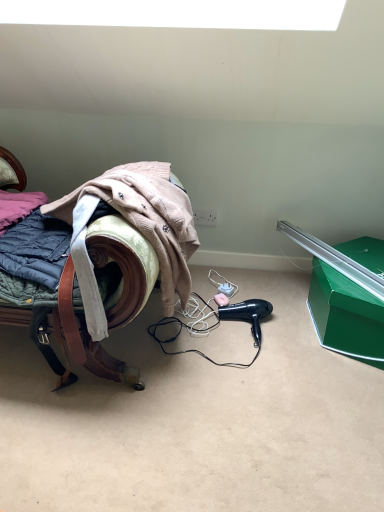
This screenshot has height=512, width=384. What are the coordinates of `velvet green suitcase at left` in the screenshot? It's located at (105, 263).

You are a GUI agent. You are given a task and a screenshot of the screen. Output one action in this format:
    pyautogui.click(x=<x>, y=<y>)
    Task: Click on the black plastic hair dryer at lower center
    
    Given the screenshot: What is the action you would take?
    pyautogui.click(x=247, y=314)

Is velvet green suitcase at left taller or shorter than green cardboard box at lower right?

Considering their sizes, velvet green suitcase at left has more height than green cardboard box at lower right.

From a real-world perspective, between velvet green suitcase at left and green cardboard box at lower right, who is vertically lower?

green cardboard box at lower right is physically lower.

From the image's perspective, is velvet green suitcase at left on top of green cardboard box at lower right?

Correct, velvet green suitcase at left appears higher than green cardboard box at lower right in the image.

From a real-world perspective, is velvet green suitcase at left on top of black plastic hair dryer at lower center?

Yes, from a real-world perspective, velvet green suitcase at left is above black plastic hair dryer at lower center.

Is velvet green suitcase at left looking in the opposite direction of black plastic hair dryer at lower center?

No.

Is velvet green suitcase at left positioned beyond the bounds of black plastic hair dryer at lower center?

That's correct, velvet green suitcase at left is outside of black plastic hair dryer at lower center.

Considering the relative positions of velvet green suitcase at left and black plastic hair dryer at lower center in the image provided, is velvet green suitcase at left to the right of black plastic hair dryer at lower center from the viewer's perspective?

Incorrect, velvet green suitcase at left is not on the right side of black plastic hair dryer at lower center.

You are a GUI agent. You are given a task and a screenshot of the screen. Output one action in this format:
    pyautogui.click(x=<x>, y=<y>)
    Task: Click on the box below the velvet green suitcase at left (from the image's perspective)
    The image size is (384, 512).
    Given the screenshot: What is the action you would take?
    pyautogui.click(x=346, y=315)

Does point (358, 317) lie in front of point (134, 293)?

No.

Which is more to the right, green cardboard box at lower right or velvet green suitcase at left?

green cardboard box at lower right is more to the right.

Is black plastic hair dryer at lower center not within green cardboard box at lower right?

black plastic hair dryer at lower center lies outside green cardboard box at lower right's area.

Which object is further away from the camera taking this photo, black plastic hair dryer at lower center or green cardboard box at lower right?

black plastic hair dryer at lower center is more distant.

Does black plastic hair dryer at lower center have a lesser height compared to green cardboard box at lower right?

Yes.

Based on the photo, from the image's perspective, between black plastic hair dryer at lower center and green cardboard box at lower right, which one is located above?

green cardboard box at lower right is shown above in the image.

Measure the distance from black plastic hair dryer at lower center to velvet green suitcase at left.

black plastic hair dryer at lower center is 60.37 centimeters away from velvet green suitcase at left.

Is point (239, 317) positioned before point (88, 366)?

No, (239, 317) is further to viewer.

From a real-world perspective, is black plastic hair dryer at lower center positioned above or below velvet green suitcase at left?

black plastic hair dryer at lower center is situated lower than velvet green suitcase at left in the real world.

Is black plastic hair dryer at lower center with velvet green suitcase at left?

No, black plastic hair dryer at lower center is not in contact with velvet green suitcase at left.

Which object is thinner, green cardboard box at lower right or black plastic hair dryer at lower center?

black plastic hair dryer at lower center.

From the image's perspective, is green cardboard box at lower right located above or below black plastic hair dryer at lower center?

Based on their image positions, green cardboard box at lower right is located above black plastic hair dryer at lower center.

From a real-world perspective, which object stands above the other?

green cardboard box at lower right is physically above.

Can you tell me how much green cardboard box at lower right and black plastic hair dryer at lower center differ in facing direction?

13.4 degrees.

Locate an element on the screen. This screenshot has width=384, height=512. box below the velvet green suitcase at left (from a real-world perspective) is located at coordinates (346, 315).

This screenshot has height=512, width=384. Identify the location of furniture in front of the black plastic hair dryer at lower center. coord(105,263).

Based on their spatial positions, is green cardboard box at lower right or black plastic hair dryer at lower center closer to velvet green suitcase at left?

Among the two, black plastic hair dryer at lower center is located nearer to velvet green suitcase at left.

Considering their positions, is velvet green suitcase at left positioned closer to green cardboard box at lower right than black plastic hair dryer at lower center?

black plastic hair dryer at lower center lies closer to green cardboard box at lower right than the other object.

Estimate the real-world distances between objects in this image. Which object is further from green cardboard box at lower right, black plastic hair dryer at lower center or velvet green suitcase at left?

velvet green suitcase at left is positioned further to the anchor green cardboard box at lower right.

Estimate the real-world distances between objects in this image. Which object is further from black plastic hair dryer at lower center, velvet green suitcase at left or green cardboard box at lower right?

velvet green suitcase at left.

Looking at the image, which one is located further to black plastic hair dryer at lower center, green cardboard box at lower right or velvet green suitcase at left?

Among the two, velvet green suitcase at left is located further to black plastic hair dryer at lower center.

From the image, which object appears to be farther from velvet green suitcase at left, black plastic hair dryer at lower center or green cardboard box at lower right?

Among the two, green cardboard box at lower right is located further to velvet green suitcase at left.

Find the location of a particular element. The height and width of the screenshot is (512, 384). hair dryer between velvet green suitcase at left and green cardboard box at lower right is located at coordinates (247, 314).